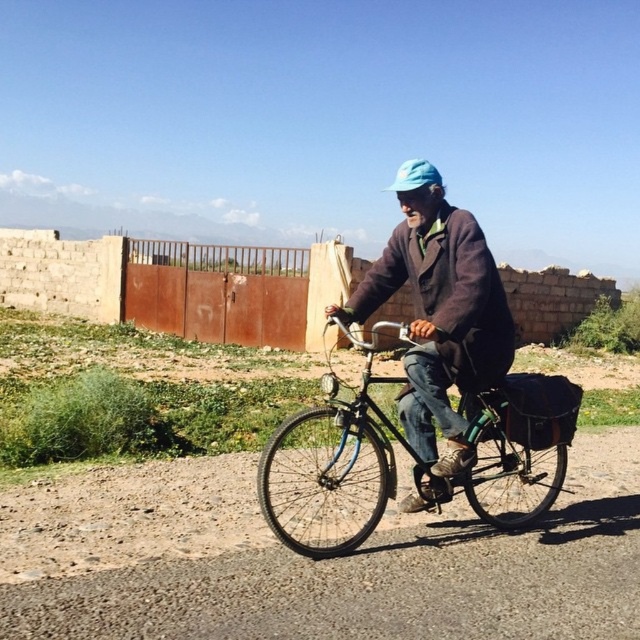
Question: Estimate the real-world distances between objects in this image. Which object is farther from the dark brown woolen jacket at center?

Choices:
 (A) blue fabric hat at center
 (B) blue metallic bicycle at center

Answer: (A)

Question: Is blue metallic bicycle at center wider than dark brown woolen jacket at center?

Choices:
 (A) no
 (B) yes

Answer: (B)

Question: Can you confirm if blue metallic bicycle at center is positioned to the left of dark brown woolen jacket at center?

Choices:
 (A) no
 (B) yes

Answer: (A)

Question: Among these objects, which one is nearest to the camera?

Choices:
 (A) blue metallic bicycle at center
 (B) dark brown woolen jacket at center
 (C) blue fabric hat at center

Answer: (A)

Question: Can you confirm if dirt gravel road at center is positioned above dark brown woolen jacket at center?

Choices:
 (A) yes
 (B) no

Answer: (B)

Question: Which is nearer to the dark brown woolen jacket at center?

Choices:
 (A) blue metallic bicycle at center
 (B) blue fabric hat at center
 (C) dirt gravel road at center

Answer: (A)